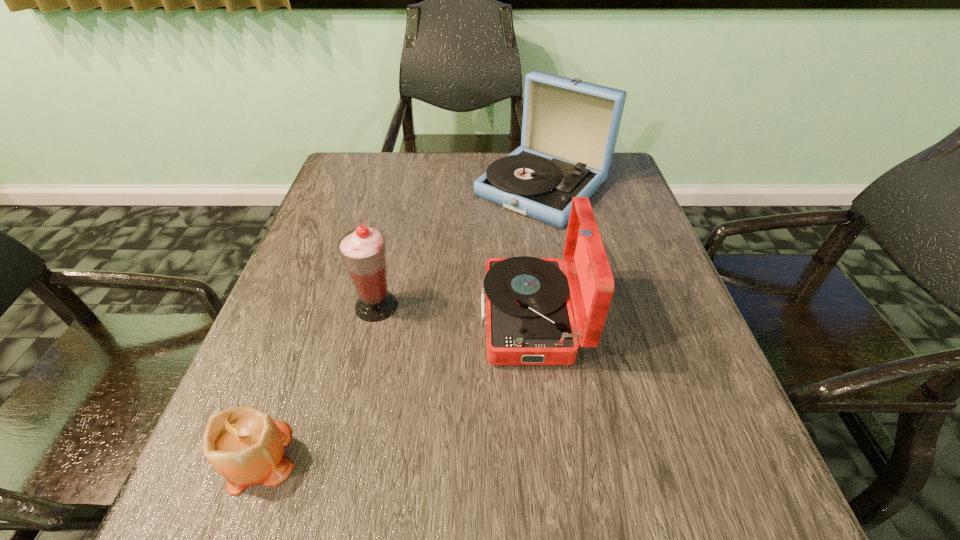
The width and height of the screenshot is (960, 540). I want to click on the farther phonograph_record, so click(x=569, y=131).

This screenshot has width=960, height=540. I want to click on the shorter phonograph_record, so click(529, 321).

Image resolution: width=960 pixels, height=540 pixels. Identify the location of smoothie. (363, 251).

This screenshot has width=960, height=540. What are the coordinates of `the leftmost object` in the screenshot? It's located at (244, 445).

Identify the location of the shortest object. The width and height of the screenshot is (960, 540). (244, 445).

Find the location of a particular element. The width and height of the screenshot is (960, 540). vacant space located on the left of the farther phonograph_record is located at coordinates (445, 187).

Where is `vacant space located 0.300m on the front-facing side of the nearer phonograph_record`? The width and height of the screenshot is (960, 540). vacant space located 0.300m on the front-facing side of the nearer phonograph_record is located at coordinates (331, 317).

Locate an element on the screen. The height and width of the screenshot is (540, 960). vacant region located 0.090m on the front-facing side of the nearer phonograph_record is located at coordinates (436, 317).

Identify the location of vacant space located 0.160m on the front-facing side of the nearer phonograph_record. This screenshot has height=540, width=960. (401, 317).

Locate an element on the screen. This screenshot has height=540, width=960. vacant space located on the back of the smoothie is located at coordinates (403, 189).